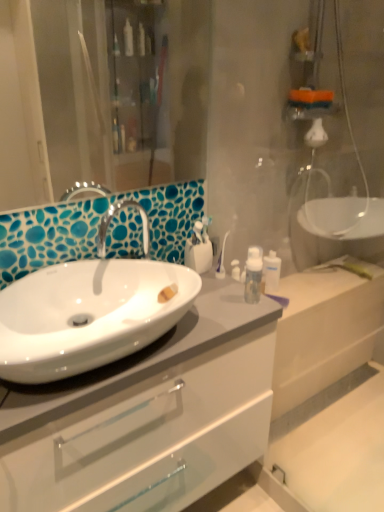
Question: Is white glossy toothbrush holder at center, acting as the 2th toiletry starting from the back, completely or partially inside transparent plastic bottle at upper right, the second toiletry viewed from the left?

Choices:
 (A) yes
 (B) no

Answer: (B)

Question: Is transparent plastic bottle at upper right, the 1th toiletry from the back, positioned before white glossy toothbrush holder at center, the 1th toiletry in the left-to-right sequence?

Choices:
 (A) no
 (B) yes

Answer: (A)

Question: From the image's perspective, is transparent plastic bottle at upper right, the 1th toiletry from the back, under white glossy toothbrush holder at center, the 1th toiletry in the left-to-right sequence?

Choices:
 (A) yes
 (B) no

Answer: (A)

Question: Is the position of transparent plastic bottle at upper right, the 1th toiletry from the back, more distant than that of white glossy toothbrush holder at center, acting as the 2th toiletry starting from the back?

Choices:
 (A) yes
 (B) no

Answer: (A)

Question: Is transparent plastic bottle at upper right, the second toiletry viewed from the left, to the left of white glossy toothbrush holder at center, acting as the 2th toiletry starting from the back, from the viewer's perspective?

Choices:
 (A) no
 (B) yes

Answer: (A)

Question: Are transparent plastic bottle at upper right, the second toiletry viewed from the left, and white glossy toothbrush holder at center, the 1th toiletry in the left-to-right sequence, located far from each other?

Choices:
 (A) no
 (B) yes

Answer: (A)

Question: From the image's perspective, is white glossy cabinet at center on white glossy sink at center left?

Choices:
 (A) no
 (B) yes

Answer: (A)

Question: Is white glossy sink at center left surrounded by white glossy cabinet at center?

Choices:
 (A) no
 (B) yes

Answer: (A)

Question: Does white glossy cabinet at center appear on the right side of white glossy sink at center left?

Choices:
 (A) yes
 (B) no

Answer: (A)

Question: Is white glossy cabinet at center in front of white glossy sink at center left?

Choices:
 (A) no
 (B) yes

Answer: (A)

Question: Does white glossy cabinet at center turn towards white glossy sink at center left?

Choices:
 (A) yes
 (B) no

Answer: (B)

Question: Does white glossy cabinet at center have a greater height compared to white glossy sink at center left?

Choices:
 (A) yes
 (B) no

Answer: (A)

Question: Is white glossy cabinet at center thinner than transparent plastic bottle at upper right, the 1th toiletry from the back?

Choices:
 (A) yes
 (B) no

Answer: (B)